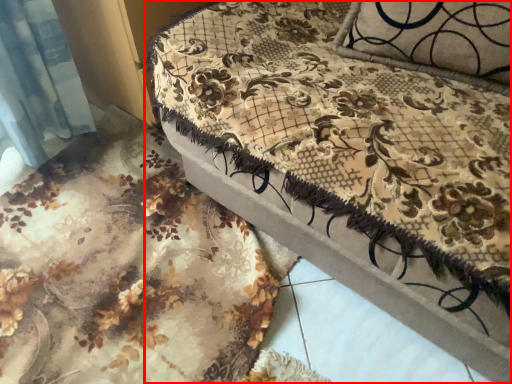
Question: Considering the relative positions of furniture (annotated by the red box) and bed frame in the image provided, where is furniture (annotated by the red box) located with respect to the staircase?

Choices:
 (A) right
 (B) left

Answer: (A)